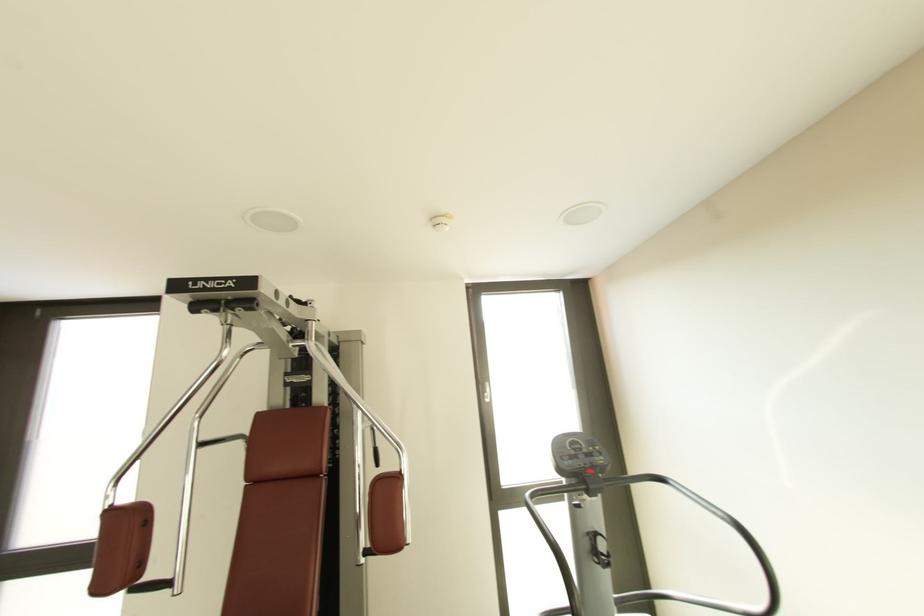
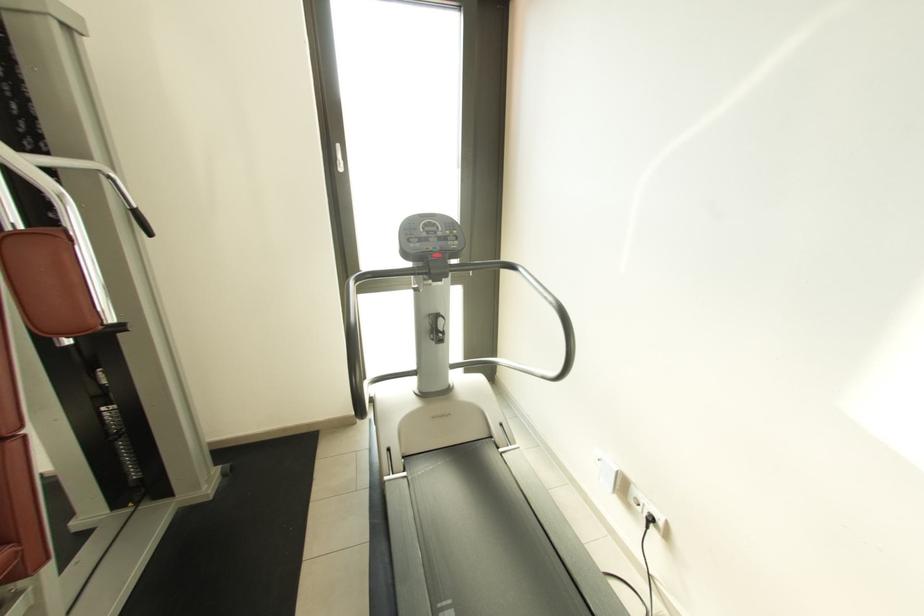
In the second image, find the point that corresponds to the point at 590,545 in the first image.

(432, 325)